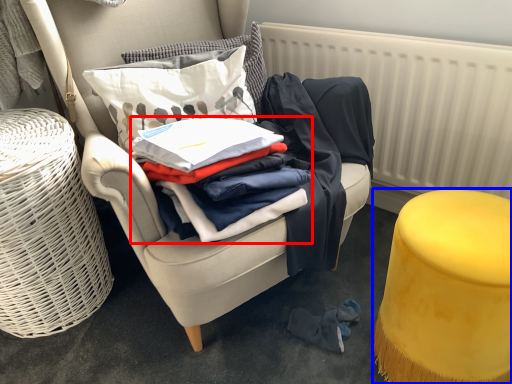
Question: Which object is further to the camera taking this photo, clothing (highlighted by a red box) or stool (highlighted by a blue box)?

Choices:
 (A) clothing
 (B) stool

Answer: (A)